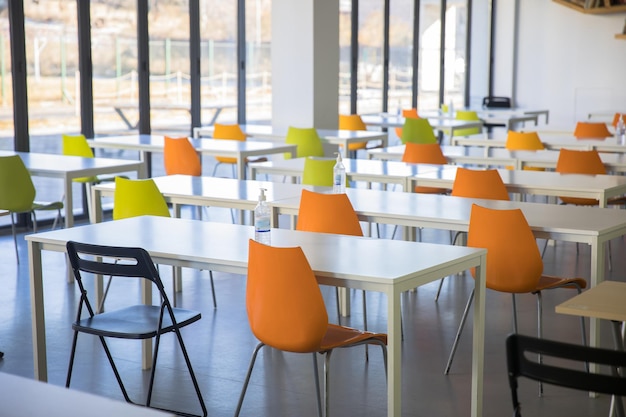
You are a GUI agent. You are given a task and a screenshot of the screen. Output one action in this format:
    pyautogui.click(x=<x>, y=<y>)
    Task: Click on the green chairs
    This screenshot has height=417, width=626.
    Given the screenshot: What is the action you would take?
    pyautogui.click(x=6, y=181), pyautogui.click(x=68, y=145), pyautogui.click(x=136, y=185), pyautogui.click(x=321, y=171), pyautogui.click(x=305, y=136), pyautogui.click(x=421, y=128), pyautogui.click(x=471, y=115)